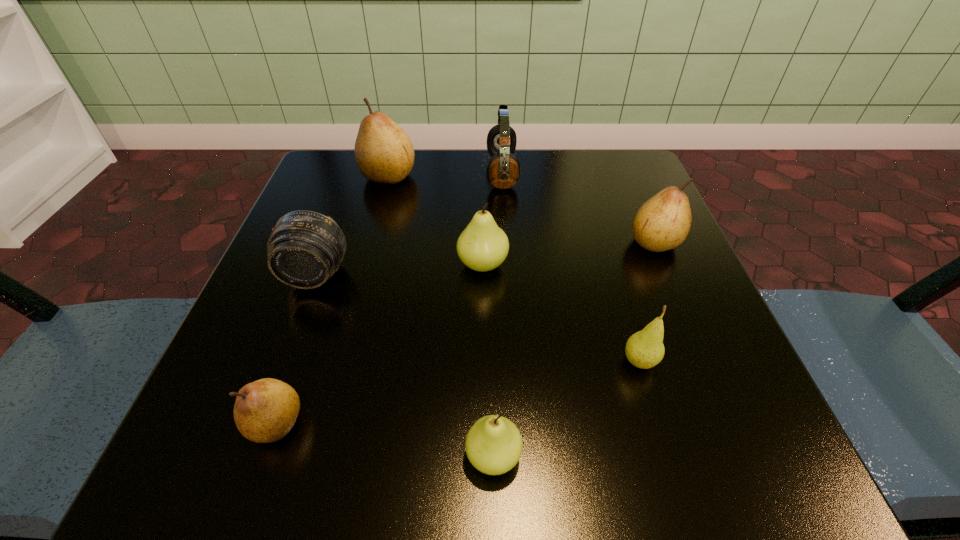
You are a GUI agent. You are given a task and a screenshot of the screen. Output one action in this format:
    pyautogui.click(x=<x>, y=<y>)
    Task: Click on the free spot that satisfies the following two spatial constraints: 1. on the ear cups of the headset; 2. at the front element of the telephoto lens
    This screenshot has height=540, width=960.
    Given the screenshot: What is the action you would take?
    pyautogui.click(x=509, y=275)

At what (x,y) coordinates should I click in order to perform the action: click on free space that satisfies the following two spatial constraints: 1. on the ear cups of the headset; 2. on the front side of the smaller green pear. Please return your answer as a coordinate pair (x, y). Image resolution: width=960 pixels, height=540 pixels. Looking at the image, I should click on (520, 456).